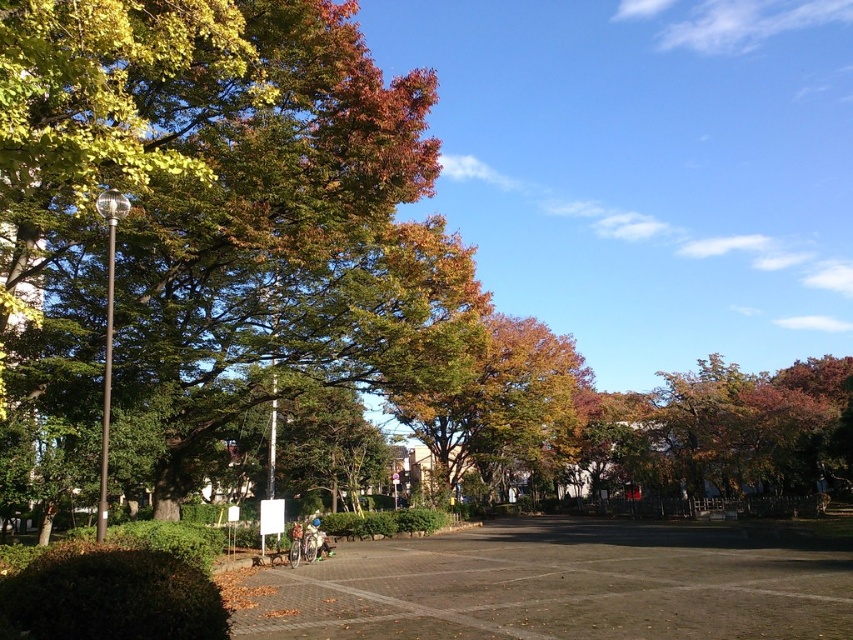
Between point (766, 616) and point (550, 369), which one is positioned behind?

Point (550, 369)

Does gray concrete parking lot at center lie in front of golden-brown foliage at center?

Yes.

Between point (624, 572) and point (520, 381), which one is positioned in front?

Positioned in front is point (624, 572).

I want to click on gray concrete parking lot at center, so [563, 586].

Who is more distant from viewer, (322, 193) or (485, 356)?

Point (485, 356)

Is green leafy tree at left shorter than golden-brown foliage at center?

Yes.

Image resolution: width=853 pixels, height=640 pixels. I want to click on green leafy tree at left, so click(x=219, y=209).

Is green leafy tree at left below gray concrete parking lot at center?

No.

Identify the location of green leafy tree at left. (219, 209).

Describe the element at coordinates (219, 209) in the screenshot. The image size is (853, 640). I see `green leafy tree at left` at that location.

This screenshot has height=640, width=853. Find the location of `green leafy tree at left`. green leafy tree at left is located at coordinates (219, 209).